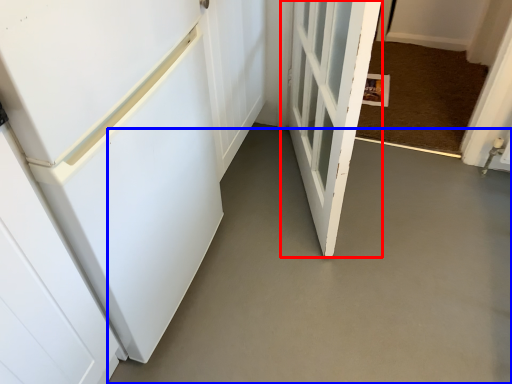
Question: Which point is closer to the camera, door (highlighted by a red box) or concrete (highlighted by a blue box)?

Choices:
 (A) door
 (B) concrete

Answer: (A)